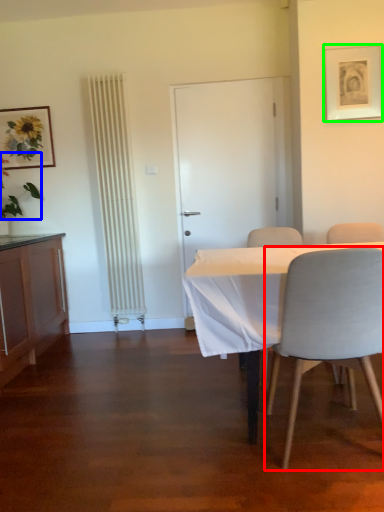
Question: Which is nearer to the chair (highlighted by a red box)? plant (highlighted by a blue box) or picture frame (highlighted by a green box).

Choices:
 (A) plant
 (B) picture frame

Answer: (B)